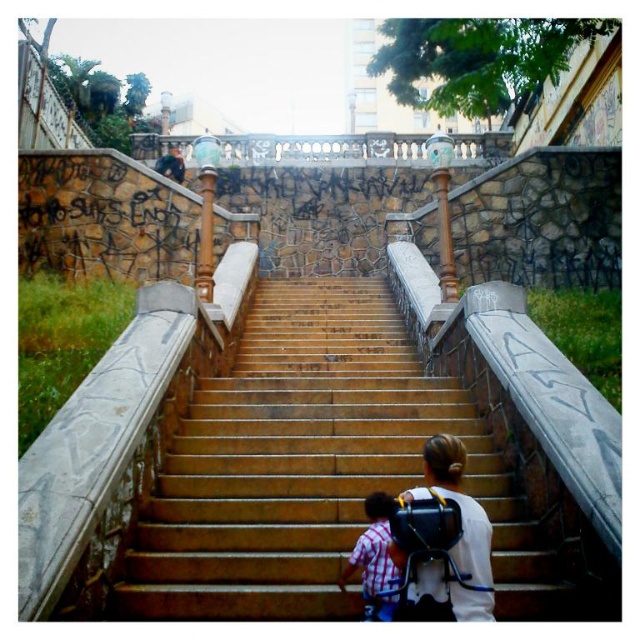
Who is positioned more to the right, brown polished stone stairs at center or white matte backpack at center?

white matte backpack at center is more to the right.

Is brown polished stone stairs at center bigger than white matte backpack at center?

Correct, brown polished stone stairs at center is larger in size than white matte backpack at center.

Does point (500, 540) lie behind point (436, 586)?

Yes.

The width and height of the screenshot is (640, 640). Identify the location of brown polished stone stairs at center. (316, 468).

Between white matte backpack at center and plaid shirt at lower center, which one is positioned lower?

Positioned lower is plaid shirt at lower center.

Does white matte backpack at center have a greater width compared to plaid shirt at lower center?

Correct, the width of white matte backpack at center exceeds that of plaid shirt at lower center.

Between point (448, 464) and point (381, 516), which one is positioned in front?

Point (381, 516) is in front.

I want to click on white matte backpack at center, so click(x=452, y=545).

Between brown polished stone stairs at center and plaid shirt at lower center, which one appears on the right side from the viewer's perspective?

plaid shirt at lower center is more to the right.

Is point (300, 401) behind point (378, 560)?

Yes.

What are the coordinates of `brown polished stone stairs at center` in the screenshot? It's located at (316, 468).